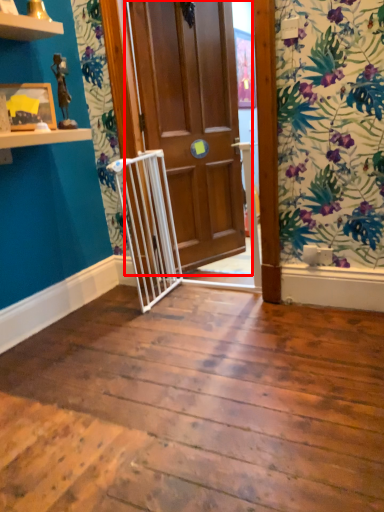
Question: In this image, where is door (annotated by the red box) located relative to picture frame?

Choices:
 (A) right
 (B) left

Answer: (A)